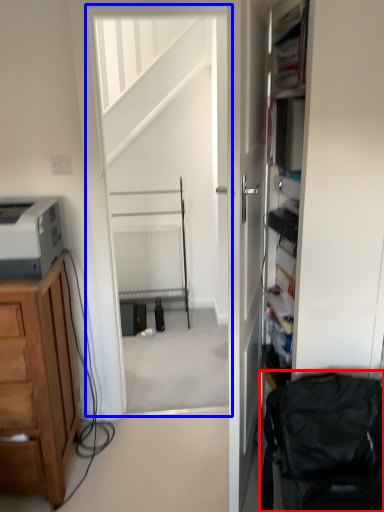
Question: Which point is further to the camera, swivel chair (highlighted by a red box) or screen door (highlighted by a blue box)?

Choices:
 (A) swivel chair
 (B) screen door

Answer: (B)